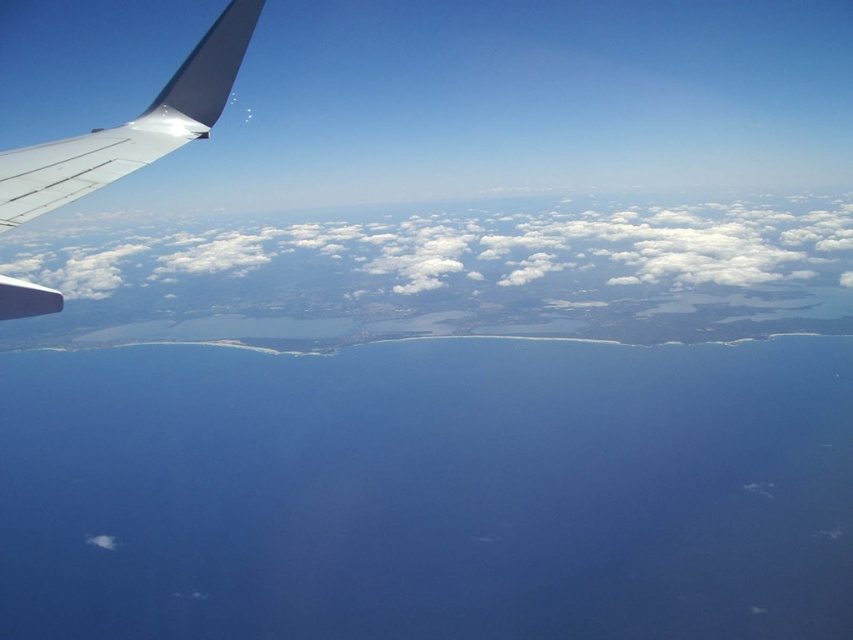
You are a passenger seated at the back of the airplane and looking out the window. You see the white fluffy cloud at center and the metallic gray wing at upper left. Which object is closer to your eyes?

The white fluffy cloud at center is closer to your eyes because it is further to the viewer than the metallic gray wing at upper left.

You are a pilot flying over the ocean and see the point marked at coordinates (428, 492). Based on the scene description, what is the color of the area at this point?

The point marked at coordinates (428, 492) is blue water at center, so the color is blue.

You are a pilot flying at an altitude of 3,000 meters. You notice the white fluffy cloud at center and the metallic gray wing at upper left. Can you safely navigate between them without colliding? Explain your reasoning.

The distance between the white fluffy cloud at center and the metallic gray wing at upper left is 654.07 meters. Given that the pilot is flying at 3,000 meters altitude, the vertical distance between the aircraft and the cloud is 3,000 meters minus the cloud base height. However, the horizontal distance between the two objects is 654.07 meters. Since aircraft typically maintain a safe horizontal separation of at least 500 meters from other aircraft or obstacles, the 654.07 meter separation here exceeds the